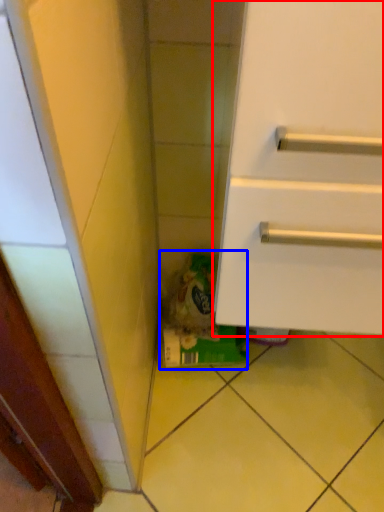
Question: Among these objects, which one is farthest to the camera, cabinetry (highlighted by a red box) or garbage (highlighted by a blue box)?

Choices:
 (A) cabinetry
 (B) garbage

Answer: (B)